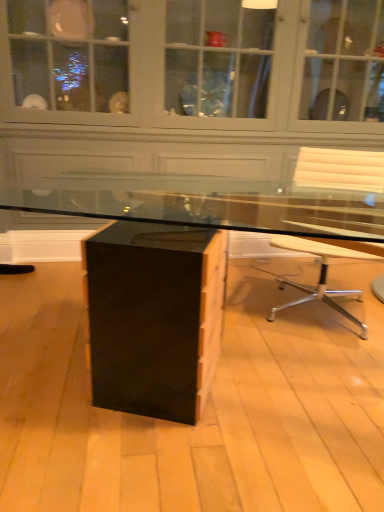
Question: From the image's perspective, is matte black desk at center under white leather chair at right?

Choices:
 (A) no
 (B) yes

Answer: (B)

Question: Is matte black desk at center located outside white leather chair at right?

Choices:
 (A) yes
 (B) no

Answer: (A)

Question: From a real-world perspective, is matte black desk at center positioned over white leather chair at right based on gravity?

Choices:
 (A) no
 (B) yes

Answer: (A)

Question: Considering the relative sizes of matte black desk at center and white leather chair at right in the image provided, is matte black desk at center wider than white leather chair at right?

Choices:
 (A) no
 (B) yes

Answer: (B)

Question: Does matte black desk at center appear on the right side of white leather chair at right?

Choices:
 (A) yes
 (B) no

Answer: (B)

Question: Is matte black desk at center taller than white leather chair at right?

Choices:
 (A) yes
 (B) no

Answer: (B)

Question: Is white leather chair at right not inside matte black desk at center?

Choices:
 (A) yes
 (B) no

Answer: (A)

Question: Can you confirm if white leather chair at right is shorter than matte black desk at center?

Choices:
 (A) no
 (B) yes

Answer: (A)

Question: Does white leather chair at right lie behind matte black desk at center?

Choices:
 (A) yes
 (B) no

Answer: (A)

Question: From a real-world perspective, is white leather chair at right positioned under matte black desk at center based on gravity?

Choices:
 (A) yes
 (B) no

Answer: (B)

Question: Is matte black desk at center at the back of white leather chair at right?

Choices:
 (A) no
 (B) yes

Answer: (A)

Question: Are white leather chair at right and matte black desk at center far apart?

Choices:
 (A) no
 (B) yes

Answer: (A)

Question: Is black glossy dresser at center with white leather chair at right?

Choices:
 (A) no
 (B) yes

Answer: (A)